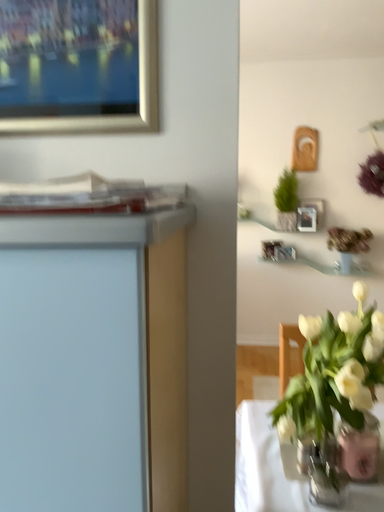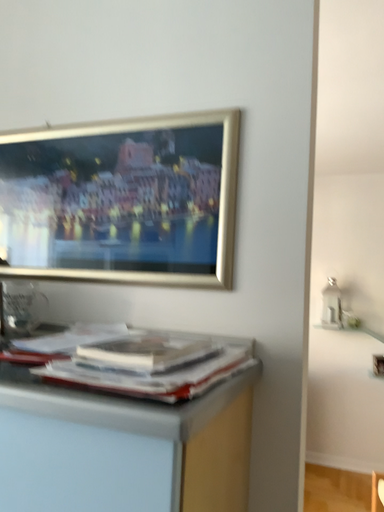
Question: Which way did the camera rotate in the video?

Choices:
 (A) rotated right
 (B) rotated left

Answer: (B)